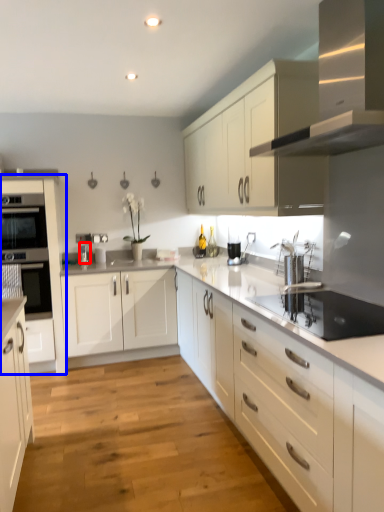
Question: Which of the following is the farthest to the observer, faucet (highlighted by a red box) or cabinetry (highlighted by a blue box)?

Choices:
 (A) faucet
 (B) cabinetry

Answer: (A)